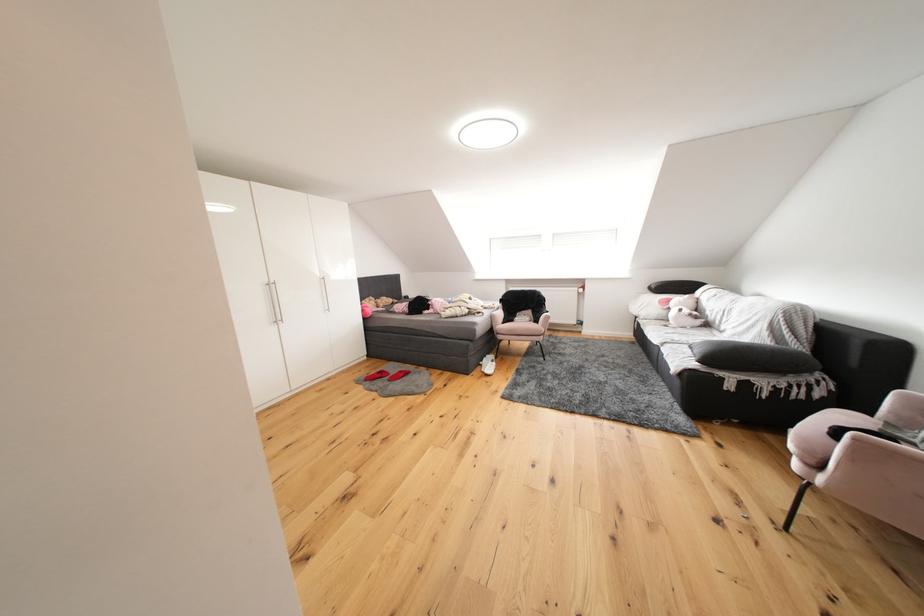
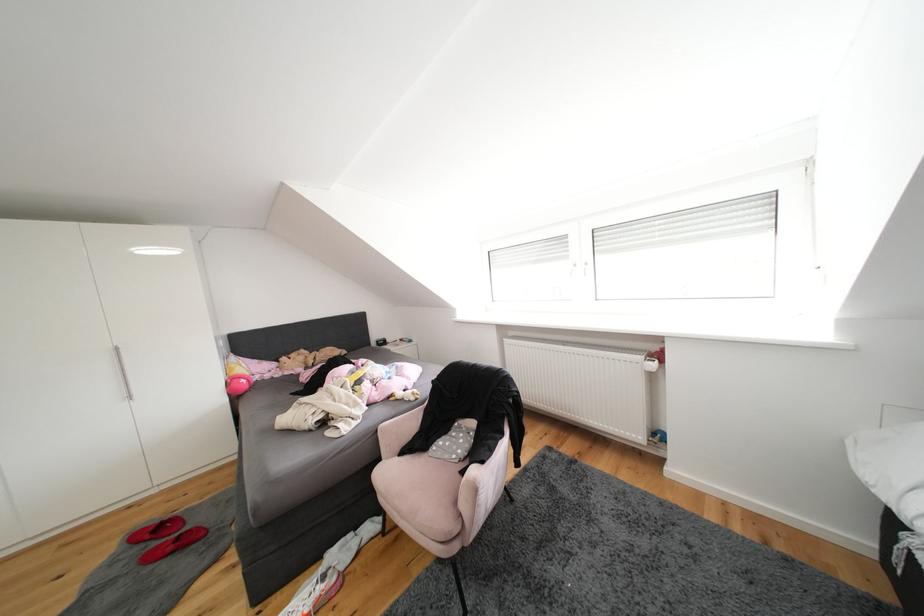
Which direction would the cameraman need to move to produce the second image?

The cameraman moved toward right, forward.